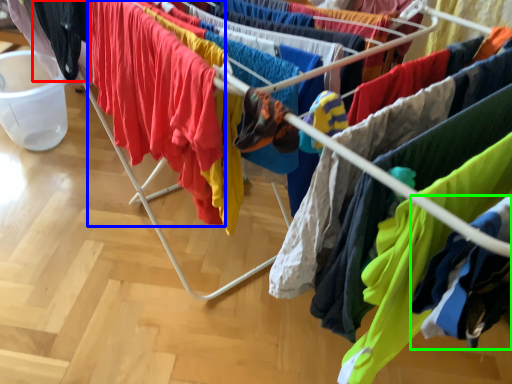
Question: Estimate the real-world distances between objects in this image. Which object is farther from clothing (highlighted by a red box), clothing (highlighted by a blue box) or clothing (highlighted by a green box)?

Choices:
 (A) clothing
 (B) clothing

Answer: (B)